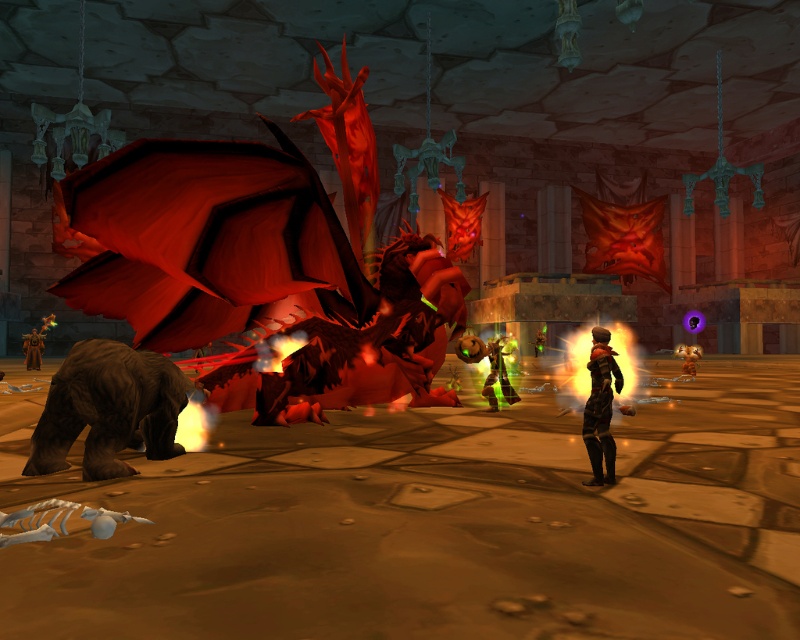
Question: Which of these objects is positioned farthest from the dark brown leather armor at center?

Choices:
 (A) smooth leather boots at lower right
 (B) brown leather armor at center
 (C) green metallic armor at center

Answer: (B)

Question: Among these points, which one is farthest from the camera?

Choices:
 (A) pyautogui.click(x=604, y=429)
 (B) pyautogui.click(x=690, y=378)
 (C) pyautogui.click(x=36, y=356)
 (D) pyautogui.click(x=490, y=378)

Answer: (C)

Question: Can you confirm if dark brown leather armor at center is wider than brown leather armor at center?

Choices:
 (A) no
 (B) yes

Answer: (A)

Question: Does dark brown leather armor at center have a greater width compared to brown leather armor at center?

Choices:
 (A) no
 (B) yes

Answer: (A)

Question: Does brown leather armor at center lie in front of smooth leather boots at lower right?

Choices:
 (A) yes
 (B) no

Answer: (B)

Question: Which object appears closest to the camera in this image?

Choices:
 (A) green metallic armor at center
 (B) brown leather armor at center
 (C) dark brown leather armor at center
 (D) smooth leather boots at lower right

Answer: (C)